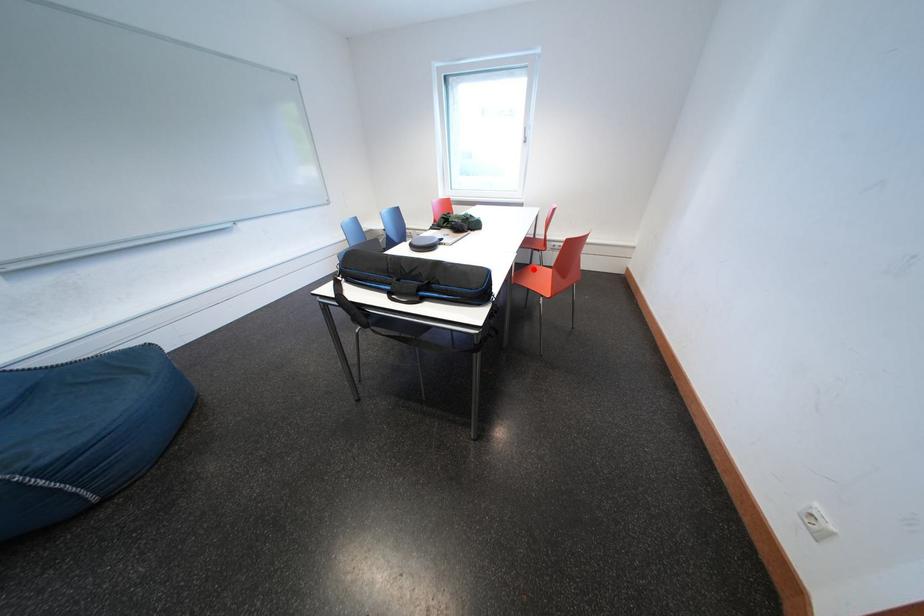
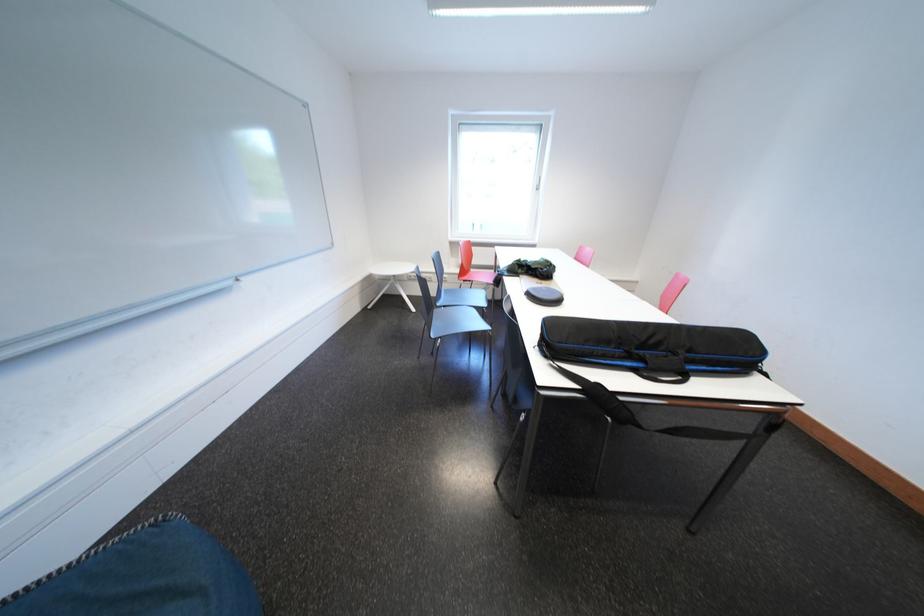
Question: I am providing you with two images of the same scene from different viewpoints. A red point is marked on the first image. Can you still see the location of the red point in image 2?

Choices:
 (A) Yes
 (B) No

Answer: (B)